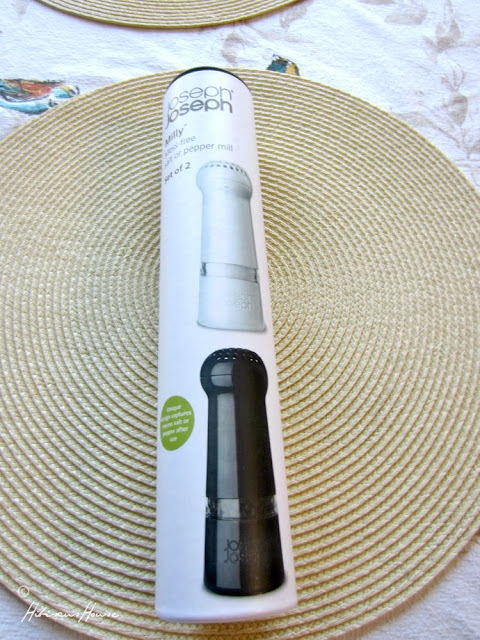
Locate an element on the screen. mat is located at coordinates (72, 323).